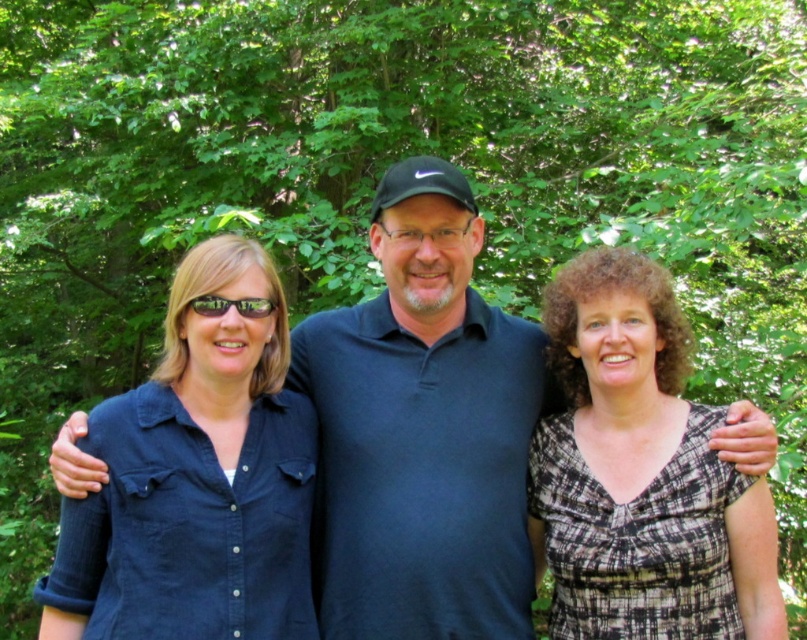
Question: Is plaid fabric dress at center thinner than black reflective sunglasses at center?

Choices:
 (A) yes
 (B) no

Answer: (B)

Question: From the image, what is the correct spatial relationship of plaid fabric dress at center in relation to black reflective sunglasses at center?

Choices:
 (A) left
 (B) right

Answer: (B)

Question: Which of the following is the closest to the observer?

Choices:
 (A) (226, 308)
 (B) (258, 397)
 (C) (576, 618)

Answer: (A)

Question: Based on their relative distances, which object is nearer to the black reflective sunglasses at center?

Choices:
 (A) denim shirt at left
 (B) plaid fabric dress at center

Answer: (A)

Question: Is plaid fabric dress at center further to the viewer compared to denim shirt at left?

Choices:
 (A) no
 (B) yes

Answer: (B)

Question: Among these objects, which one is farthest from the camera?

Choices:
 (A) black reflective sunglasses at center
 (B) denim shirt at left
 (C) plaid fabric dress at center

Answer: (C)